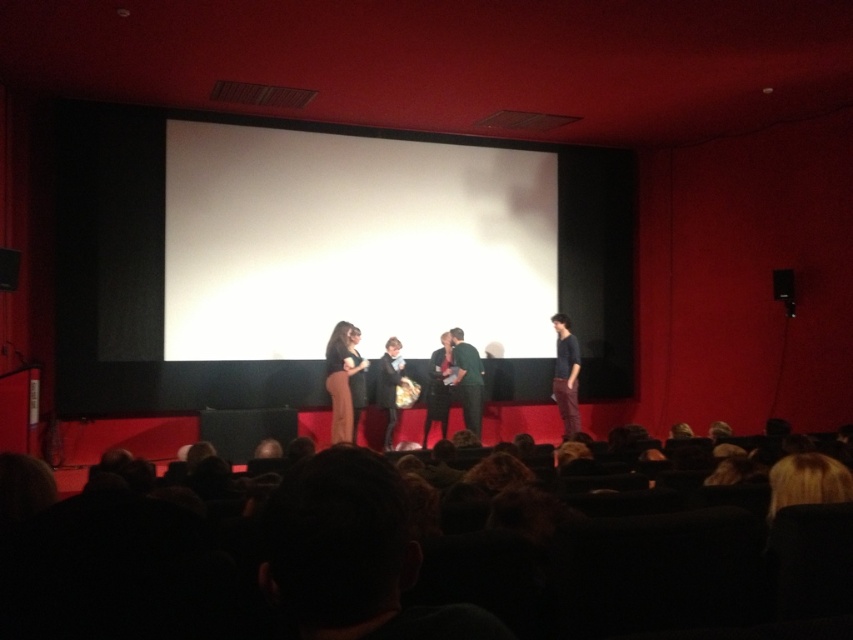
Question: Is dark blue shirt at center below velvet black coat at center?

Choices:
 (A) yes
 (B) no

Answer: (B)

Question: Which object appears farthest from the camera in this image?

Choices:
 (A) velvet black coat at center
 (B) green fabric dress at center

Answer: (B)

Question: Which of the following is the farthest from the observer?

Choices:
 (A) (379, 376)
 (B) (572, 433)
 (C) (351, 413)

Answer: (B)

Question: Does matte black dress at center appear over green fabric dress at center?

Choices:
 (A) no
 (B) yes

Answer: (B)

Question: Considering the relative positions of dark blue shirt at center and green fabric dress at center in the image provided, where is dark blue shirt at center located with respect to green fabric dress at center?

Choices:
 (A) above
 (B) below

Answer: (A)

Question: Which of these objects is positioned closest to the matte black dress at center?

Choices:
 (A) green fabric dress at center
 (B) dark blue shirt at center
 (C) velvet black coat at center

Answer: (C)